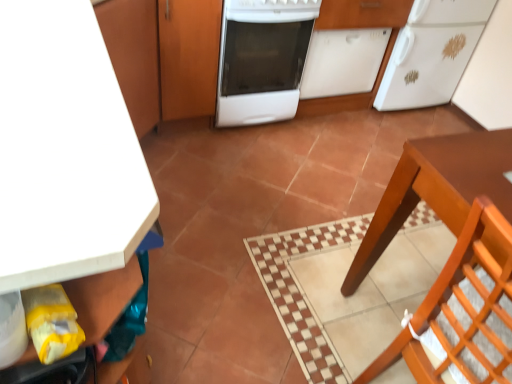
Question: From a real-world perspective, is matte wood cabinet at upper left, the 4th cabinetry positioned from the right, positioned under white matte cabinet at upper left, which ranks as the third cabinetry in right-to-left order, based on gravity?

Choices:
 (A) no
 (B) yes

Answer: (B)

Question: Would you say matte wood cabinet at upper left, marked as the first cabinetry in a left-to-right arrangement, is outside white matte cabinet at upper left, which is counted as the second cabinetry, starting from the left?

Choices:
 (A) yes
 (B) no

Answer: (A)

Question: From the image's perspective, is matte wood cabinet at upper left, marked as the first cabinetry in a left-to-right arrangement, beneath white matte cabinet at upper left, which ranks as the third cabinetry in right-to-left order?

Choices:
 (A) no
 (B) yes

Answer: (A)

Question: From the image's perspective, would you say matte wood cabinet at upper left, the 4th cabinetry positioned from the right, is positioned over white matte cabinet at upper left, which ranks as the third cabinetry in right-to-left order?

Choices:
 (A) no
 (B) yes

Answer: (B)

Question: Does matte wood cabinet at upper left, the 4th cabinetry positioned from the right, lie behind white matte cabinet at upper left, which ranks as the third cabinetry in right-to-left order?

Choices:
 (A) no
 (B) yes

Answer: (B)

Question: Is point (126, 9) closer or farther from the camera than point (444, 284)?

Choices:
 (A) farther
 (B) closer

Answer: (A)

Question: From a real-world perspective, relative to wooden chair at lower right, is matte wood cabinet at upper left, marked as the first cabinetry in a left-to-right arrangement, vertically above or below?

Choices:
 (A) above
 (B) below

Answer: (B)

Question: In the image, is matte wood cabinet at upper left, marked as the first cabinetry in a left-to-right arrangement, positioned in front of or behind wooden chair at lower right?

Choices:
 (A) front
 (B) behind

Answer: (B)

Question: Looking at their shapes, would you say matte wood cabinet at upper left, the 4th cabinetry positioned from the right, is wider or thinner than wooden chair at lower right?

Choices:
 (A) thin
 (B) wide

Answer: (B)

Question: Based on their sizes in the image, would you say wooden cabinet at center, arranged as the third cabinetry when viewed from the left, is bigger or smaller than white glossy dishwasher at center?

Choices:
 (A) big
 (B) small

Answer: (B)

Question: Looking at their shapes, would you say wooden cabinet at center, arranged as the third cabinetry when viewed from the left, is wider or thinner than white glossy dishwasher at center?

Choices:
 (A) wide
 (B) thin

Answer: (A)

Question: From the image's perspective, is wooden cabinet at center, arranged as the third cabinetry when viewed from the left, positioned above or below white glossy dishwasher at center?

Choices:
 (A) below
 (B) above

Answer: (A)

Question: From their relative heights in the image, would you say wooden cabinet at center, arranged as the third cabinetry when viewed from the left, is taller or shorter than white glossy dishwasher at center?

Choices:
 (A) short
 (B) tall

Answer: (B)

Question: From the image's perspective, is white glossy dishwasher at center above or below white matte dishwasher at center, the 4th cabinetry from the left?

Choices:
 (A) above
 (B) below

Answer: (B)

Question: Does point (305, 16) appear closer or farther from the camera than point (340, 59)?

Choices:
 (A) closer
 (B) farther

Answer: (A)